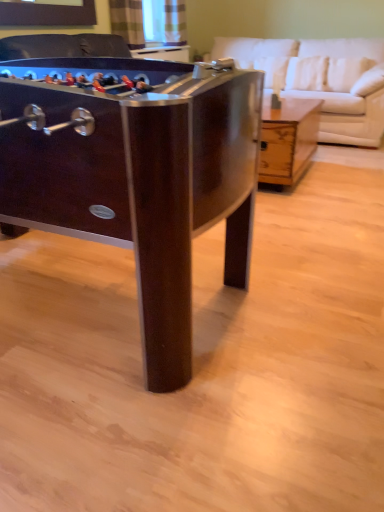
Find the location of a particular element. vacant region in front of wooden coffee table at center, marked as the second table in a front-to-back arrangement is located at coordinates (313, 206).